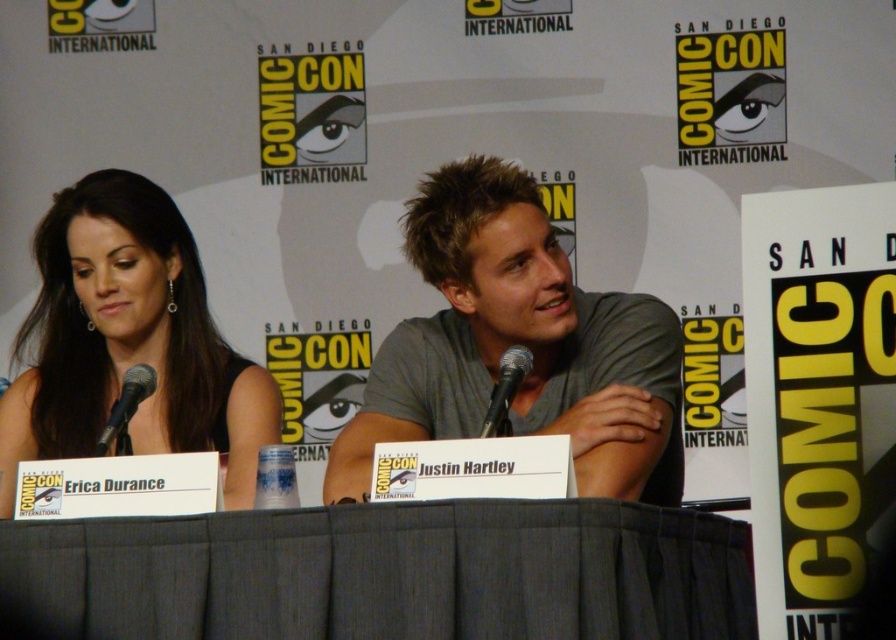
Does point (82, 436) come closer to viewer compared to point (100, 435)?

No, it is behind (100, 435).

Is matte black dress at left to the right of black matte microphone at left from the viewer's perspective?

Incorrect, matte black dress at left is not on the right side of black matte microphone at left.

This screenshot has width=896, height=640. I want to click on matte black dress at left, so click(128, 340).

Does gray cotton shirt at center appear on the left side of black metallic microphone at center?

Correct, you'll find gray cotton shirt at center to the left of black metallic microphone at center.

Who is more distant from viewer, (509,224) or (496,433)?

Positioned behind is point (509,224).

Where is `gray cotton shirt at center`? Image resolution: width=896 pixels, height=640 pixels. gray cotton shirt at center is located at coordinates (520, 344).

Does gray fabric table at center have a larger size compared to gray cotton shirt at center?

Incorrect, gray fabric table at center is not larger than gray cotton shirt at center.

Where is `gray fabric table at center`? The height and width of the screenshot is (640, 896). gray fabric table at center is located at coordinates (383, 573).

Does point (682, 528) lie behind point (389, 394)?

No, it is not.

The height and width of the screenshot is (640, 896). In order to click on gray fabric table at center in this screenshot , I will do `click(383, 573)`.